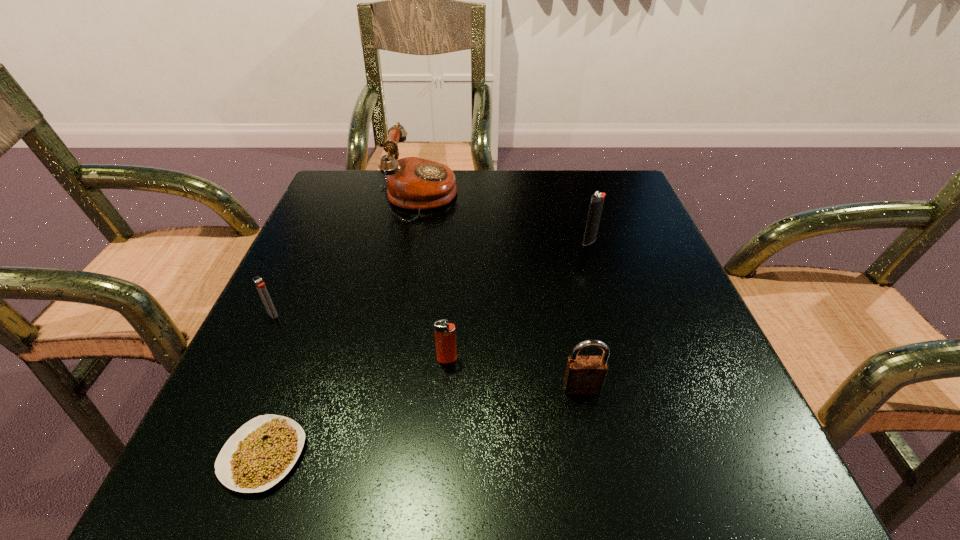
Where is `igniter present at the left edge`? igniter present at the left edge is located at coordinates (260, 285).

At what (x,y) coordinates should I click in order to perform the action: click on legume situated at the left edge. Please return your answer as a coordinate pair (x, y). Looking at the image, I should click on (260, 453).

Locate an element on the screen. The image size is (960, 540). object that is at the right edge is located at coordinates (596, 204).

This screenshot has width=960, height=540. In order to click on object present at the far left corner in this screenshot , I will do `click(414, 183)`.

The width and height of the screenshot is (960, 540). Identify the location of object located in the near left corner section of the desktop. (260, 453).

Where is `vacant space at the far edge`? vacant space at the far edge is located at coordinates (466, 183).

Locate an element on the screen. Image resolution: width=960 pixels, height=540 pixels. free space at the near edge of the desktop is located at coordinates (548, 497).

Identify the location of free space at the left edge. This screenshot has height=540, width=960. (304, 317).

The height and width of the screenshot is (540, 960). In the image, there is a desktop. Find the location of `free region at the right edge`. free region at the right edge is located at coordinates (668, 335).

Where is `vacant space at the far left corner of the desktop`? vacant space at the far left corner of the desktop is located at coordinates (372, 175).